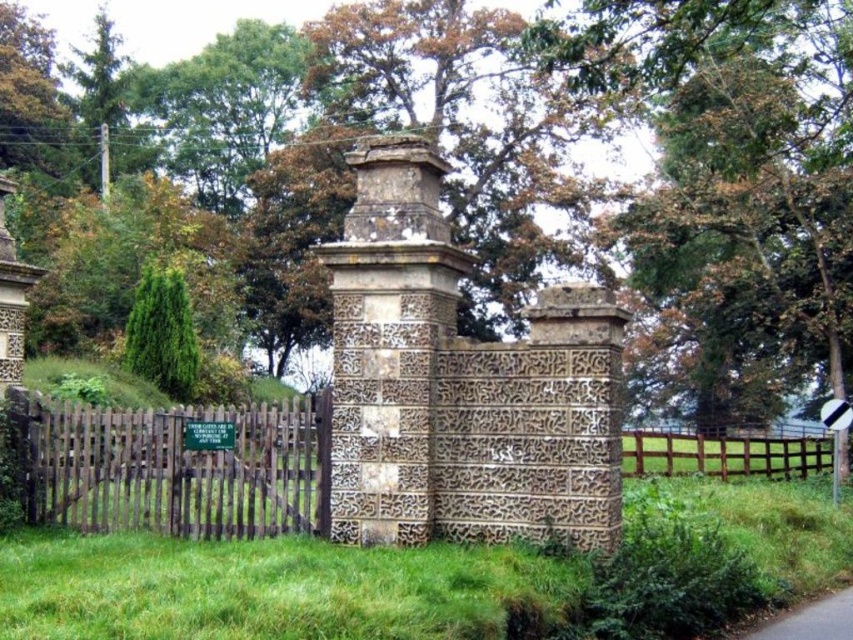
You are standing at the entrance of a rural property and see the carved stone pillar at center and the gray asphalt road at lower right. Which object is closer to your left side?

The carved stone pillar at center is to the left of gray asphalt road at lower right, so it is closer to your left side.

You are standing at the entrance of a rural property and see the brown wooden fence at center and the carved stone pillar at center. You want to place a 1.5 meter wide flower bed between them. Is there enough space?

The brown wooden fence at center is 12.96 meters away from the carved stone pillar at center. Since the flower bed is only 1.5 meters wide, there is plenty of space between them to place it.

Consider the image. You are a delivery driver who needs to park your vehicle on the gray asphalt road at lower right. Your vehicle requires a parking space of 25 feet in length. Based on the image, can you safely park your vehicle there without blocking the carved stone pillar at center?

The distance between the carved stone pillar at center and the gray asphalt road at lower right is 23.77 feet. Since your vehicle needs 25 feet of space, it is not possible to park there without overlapping into the area near the pillar, which might block it. Choose another spot.